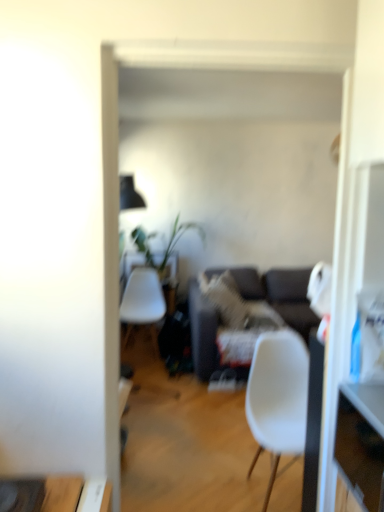
Question: Can you confirm if green leafy plant at center is thinner than dark gray fabric couch at center?

Choices:
 (A) no
 (B) yes

Answer: (B)

Question: From the image's perspective, is green leafy plant at center located above dark gray fabric couch at center?

Choices:
 (A) yes
 (B) no

Answer: (A)

Question: Is green leafy plant at center positioned before dark gray fabric couch at center?

Choices:
 (A) yes
 (B) no

Answer: (B)

Question: Is green leafy plant at center behind dark gray fabric couch at center?

Choices:
 (A) yes
 (B) no

Answer: (A)

Question: Is green leafy plant at center not within dark gray fabric couch at center?

Choices:
 (A) no
 (B) yes

Answer: (B)

Question: Can you confirm if green leafy plant at center is taller than dark gray fabric couch at center?

Choices:
 (A) yes
 (B) no

Answer: (B)

Question: Does green leafy plant at center appear on the left side of white matte chair at center?

Choices:
 (A) yes
 (B) no

Answer: (A)

Question: From a real-world perspective, is green leafy plant at center positioned over white matte chair at center based on gravity?

Choices:
 (A) yes
 (B) no

Answer: (A)

Question: Is green leafy plant at center closer to the viewer compared to white matte chair at center?

Choices:
 (A) no
 (B) yes

Answer: (A)

Question: Does green leafy plant at center have a lesser height compared to white matte chair at center?

Choices:
 (A) no
 (B) yes

Answer: (B)

Question: Is green leafy plant at center smaller than white matte chair at center?

Choices:
 (A) yes
 (B) no

Answer: (B)

Question: From the image's perspective, is green leafy plant at center beneath white matte chair at center?

Choices:
 (A) yes
 (B) no

Answer: (B)

Question: Are wooden drawer at right and white matte chair at center making contact?

Choices:
 (A) no
 (B) yes

Answer: (A)